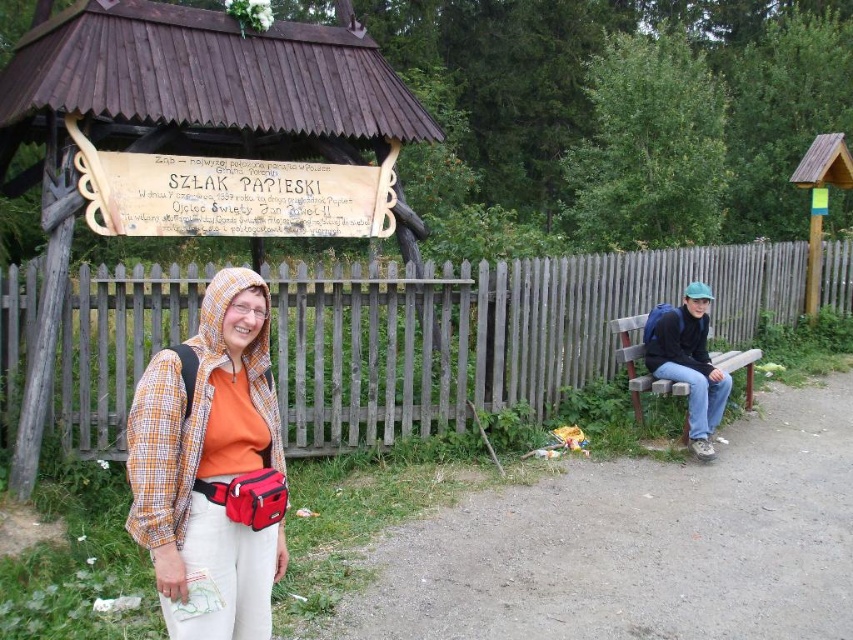
Who is taller, blue backpack at right or wooden bench at right?

With more height is blue backpack at right.

Can you confirm if blue backpack at right is thinner than wooden bench at right?

In fact, blue backpack at right might be wider than wooden bench at right.

Who is more forward, [677,358] or [636,403]?

Point [677,358]

In order to click on blue backpack at right in this screenshot , I will do `click(689, 364)`.

Is wooden at center shorter than matte orange shirt at center?

Yes, wooden at center is shorter than matte orange shirt at center.

Who is positioned more to the right, wooden at center or matte orange shirt at center?

Positioned to the right is matte orange shirt at center.

Who is more distant from viewer, (x=390, y=397) or (x=242, y=387)?

The point (x=390, y=397) is behind.

Locate an element on the screen. This screenshot has height=640, width=853. wooden at center is located at coordinates (486, 332).

Does dirt path at center have a greater width compared to blue backpack at right?

Correct, the width of dirt path at center exceeds that of blue backpack at right.

Between dirt path at center and blue backpack at right, which one is positioned higher?

blue backpack at right is above.

Locate an element on the screen. dirt path at center is located at coordinates (x=639, y=544).